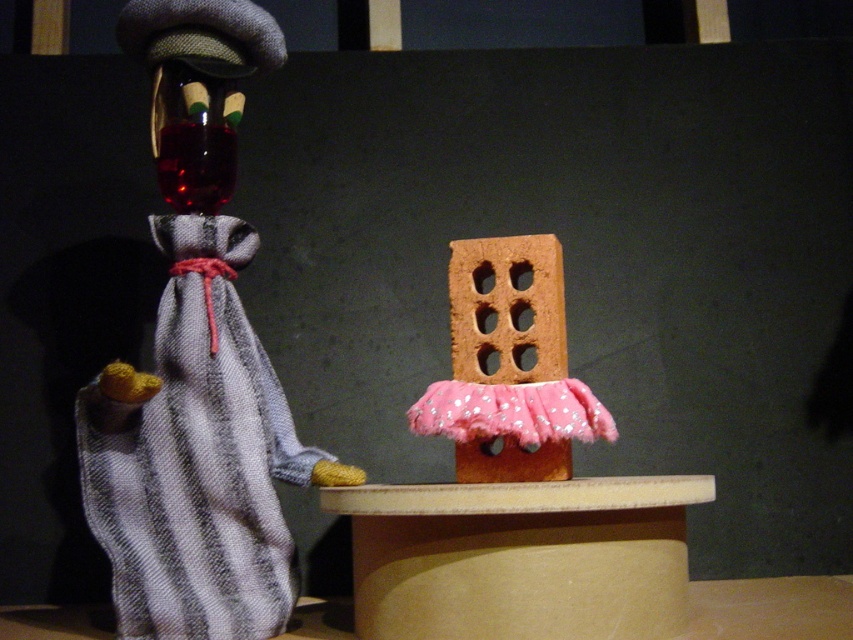
Who is positioned more to the right, striped fabric doll at left or pink felt brick at center?

pink felt brick at center is more to the right.

Is point (120, 632) closer to camera compared to point (473, 376)?

Yes, point (120, 632) is in front of point (473, 376).

Where is `striped fabric doll at left`? Image resolution: width=853 pixels, height=640 pixels. striped fabric doll at left is located at coordinates pos(196,365).